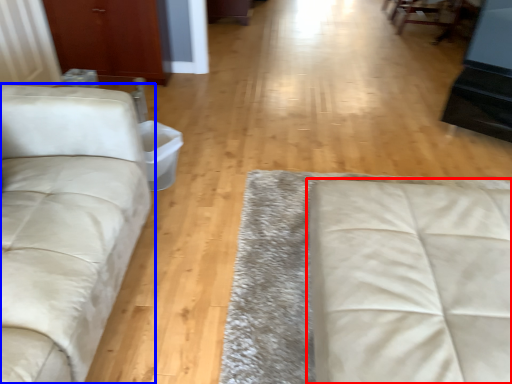
Question: Which of the following is the closest to the observer, studio couch (highlighted by a red box) or studio couch (highlighted by a blue box)?

Choices:
 (A) studio couch
 (B) studio couch

Answer: (B)